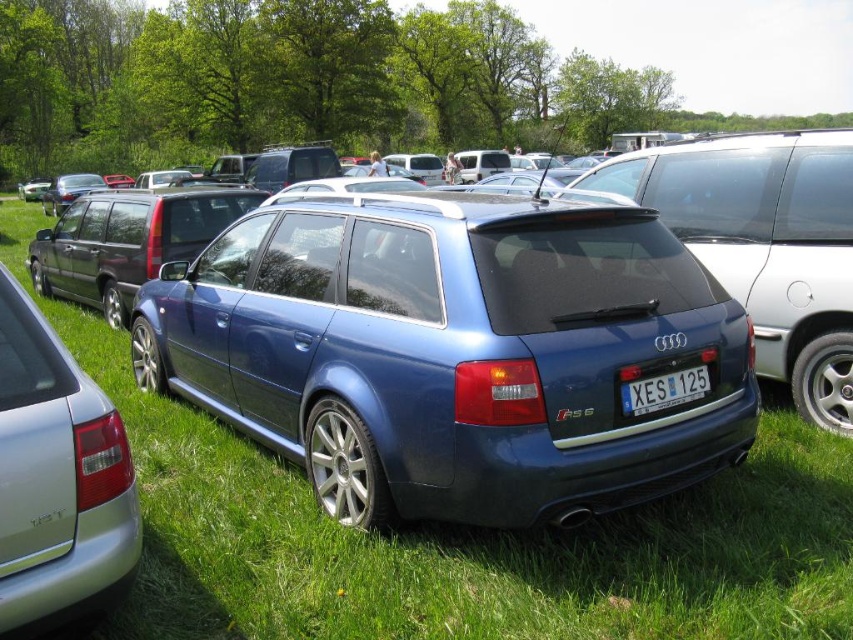
Question: Is metallic blue station wagon at center to the left of white plastic license plate at center from the viewer's perspective?

Choices:
 (A) yes
 (B) no

Answer: (A)

Question: Is metallic blue station wagon at center to the right of satin silver sedan at lower left from the viewer's perspective?

Choices:
 (A) no
 (B) yes

Answer: (B)

Question: Estimate the real-world distances between objects in this image. Which object is closer to the white plastic license plate at center?

Choices:
 (A) matte black minivan at center
 (B) satin silver sedan at lower left

Answer: (B)

Question: Which of the following is the closest to the observer?

Choices:
 (A) (26, 392)
 (B) (677, 392)
 (C) (314, 285)

Answer: (A)

Question: Does metallic blue station wagon at center have a lesser width compared to satin silver sedan at lower left?

Choices:
 (A) no
 (B) yes

Answer: (A)

Question: Estimate the real-world distances between objects in this image. Which object is closer to the matte black minivan at center?

Choices:
 (A) metallic blue station wagon at center
 (B) satin silver sedan at lower left

Answer: (A)